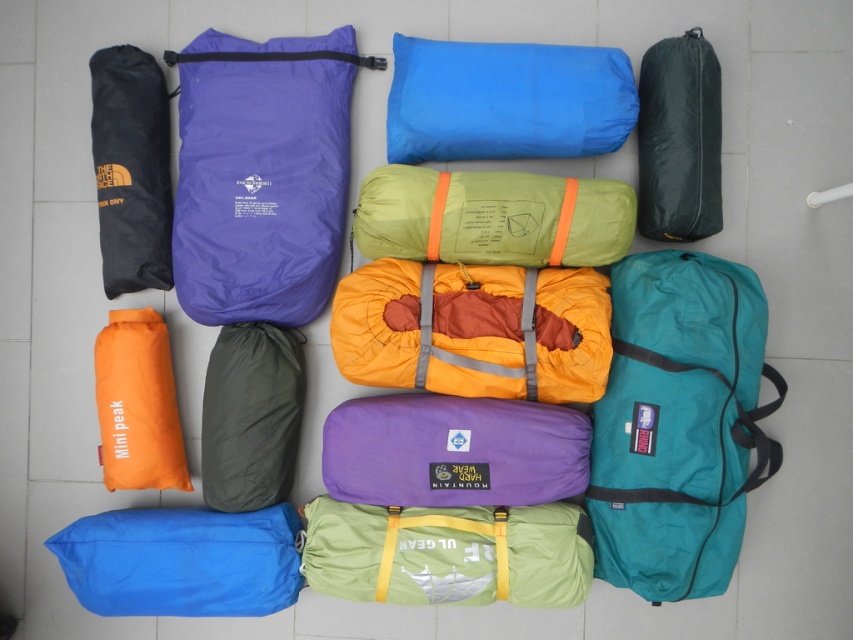
You are organizing camping gear and need to stack the teal fabric duffel at center right and the black nylon bag at upper left vertically. Which one should you place at the bottom to ensure stability?

The teal fabric duffel at center right should be placed at the bottom since it is much taller than the black nylon bag at upper left, providing a larger base for stability.

You are a camper who needs to place a new gear bag between the blue fabric sleeping bag at center and the black nylon bag at upper left. The new bag measures 45 centimeters in length. Will there be enough space to fit it between them?

The distance between the blue fabric sleeping bag at center and the black nylon bag at upper left is 47.02 centimeters. Since the new bag is 45 centimeters long, there is sufficient space to place it between them.